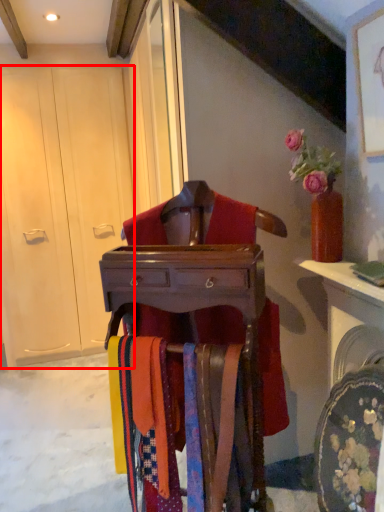
Question: From the image, what is the correct spatial relationship of armoire (annotated by the red box) in relation to furniture?

Choices:
 (A) right
 (B) left

Answer: (B)